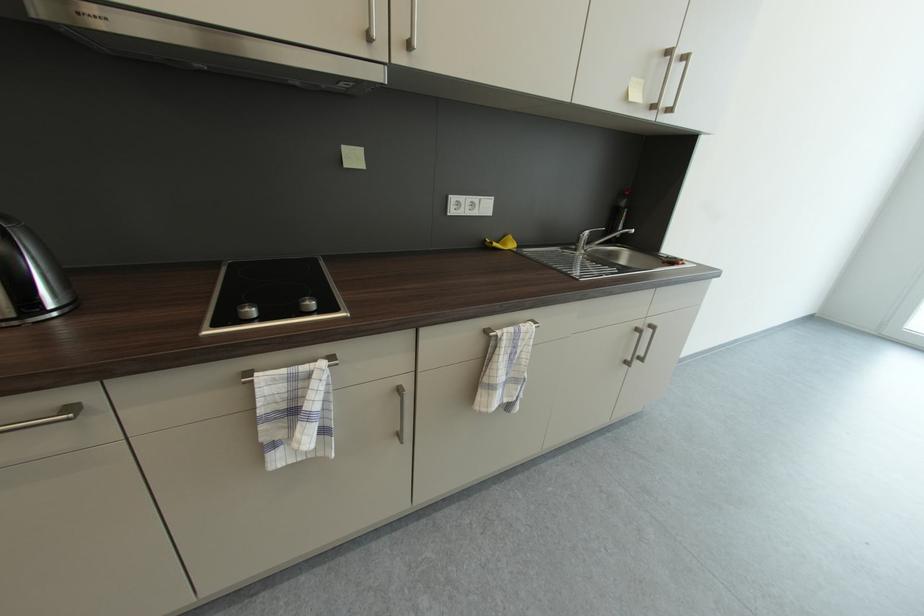
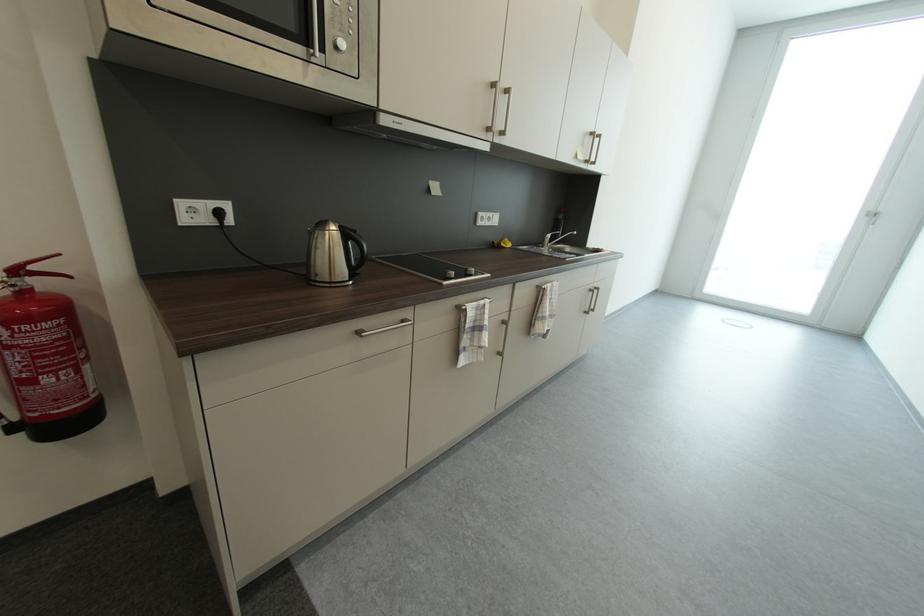
Find the pixel in the second image that matches pixel 259 313 in the first image.

(458, 275)